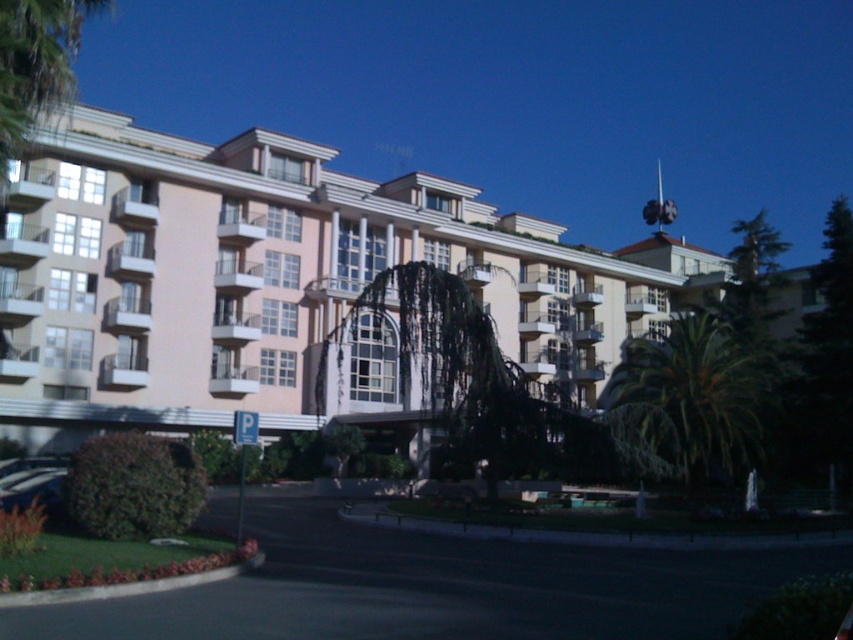
Question: Which object appears closest to the camera in this image?

Choices:
 (A) beige/smooth building at center
 (B) green leafy palm at right

Answer: (B)

Question: Which object is closer to the camera taking this photo?

Choices:
 (A) metallic silver car at lower left
 (B) green leafy palm at right
 (C) beige/smooth building at center

Answer: (A)

Question: Is green leafy palm at right positioned in front of green leafy palm tree at upper left?

Choices:
 (A) no
 (B) yes

Answer: (A)

Question: Is beige/smooth building at center to the left of green leafy palm tree at upper left from the viewer's perspective?

Choices:
 (A) no
 (B) yes

Answer: (A)

Question: Which point is farther to the camera?

Choices:
 (A) (3, 68)
 (B) (123, 420)

Answer: (B)

Question: Can you confirm if beige/smooth building at center is thinner than green leafy palm tree at upper left?

Choices:
 (A) no
 (B) yes

Answer: (A)